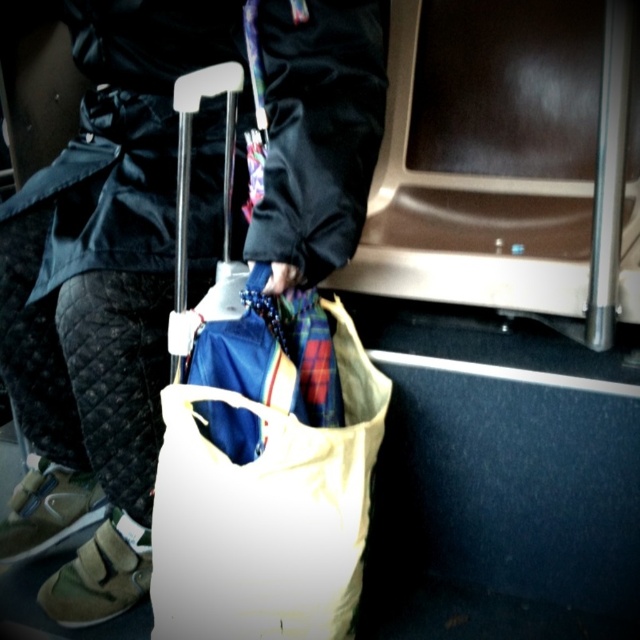
Can you confirm if matte black jacket at center is positioned below white canvas bag at center?

No, matte black jacket at center is not below white canvas bag at center.

Who is taller, matte black jacket at center or white canvas bag at center?

With more height is matte black jacket at center.

Who is more distant from viewer, (56, 609) or (294, 577)?

The point (56, 609) is behind.

Where is `matte black jacket at center`? matte black jacket at center is located at coordinates (100, 298).